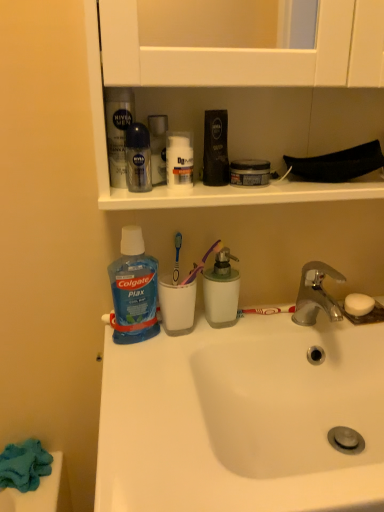
Question: Is point (173, 272) positioned closer to the camera than point (173, 140)?

Choices:
 (A) farther
 (B) closer

Answer: (A)

Question: Visually, is blue plastic toothbrush at center, which is the 1th toothbrush from left to right, positioned to the left or to the right of white matte jar at upper center, acting as the first toiletry starting from the left?

Choices:
 (A) left
 (B) right

Answer: (A)

Question: Which object is the farthest from the purple plastic toothbrush at center, positioned as the 2th toothbrush in right-to-left order?

Choices:
 (A) white ceramic sink at center, the 2th sink from the bottom
 (B) translucent plastic mouthwash at center, the 2th mouthwash in the right-to-left sequence
 (C) blue plastic toothbrush at center, which is the 1th toothbrush from left to right
 (D) blue glossy mouthwash at upper center, which is the 4th mouthwash from right to left
 (E) white plastic toothbrush at sink, which is the 3th toothbrush in left-to-right order

Answer: (A)

Question: Estimate the real-world distances between objects in this image. Which object is farther from the white ceramic sink at center, positioned as the second sink in top-to-bottom order?

Choices:
 (A) clear plastic bottle at upper center, placed as the second mouthwash when sorted from left to right
 (B) white ceramic sink at center, the 2th sink from the bottom
 (C) blue plastic toothbrush at center, which is the 1th toothbrush from left to right
 (D) matte plastic mouthwash at upper center, which is the 4th mouthwash in left-to-right order
 (E) blue translucent liquid at lower left

Answer: (A)